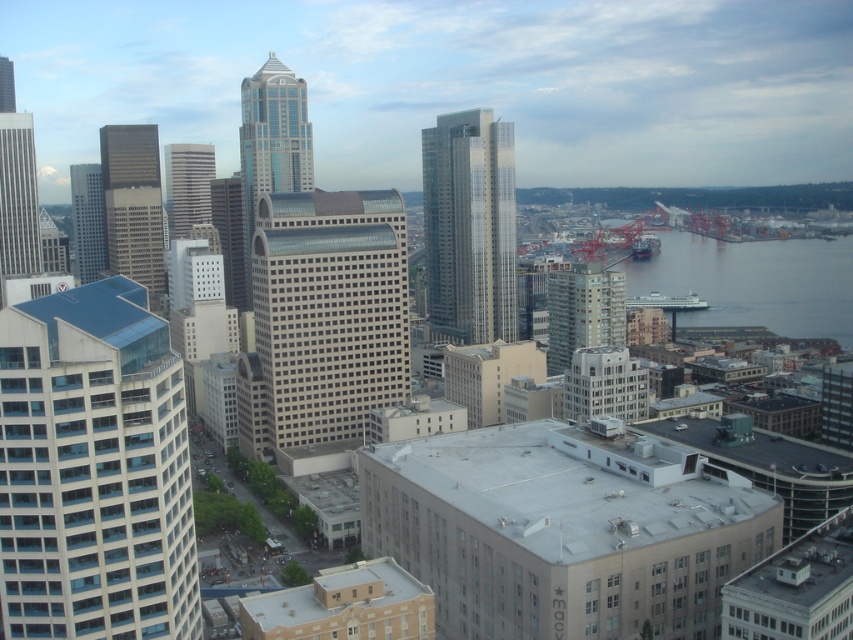
Who is more forward, (311, 170) or (73, 189)?

Point (311, 170)

In the scene shown: Is glassy steel skyscraper at center thinner than glassy reflective skyscraper at left?

Incorrect, glassy steel skyscraper at center's width is not less than glassy reflective skyscraper at left's.

Between point (287, 186) and point (94, 172), which one is positioned in front?

Positioned in front is point (287, 186).

Locate an element on the screen. The width and height of the screenshot is (853, 640). glassy steel skyscraper at center is located at coordinates (271, 144).

Does glassy steel skyscraper at center have a greater height compared to glassy concrete building at center?

Correct, glassy steel skyscraper at center is much taller as glassy concrete building at center.

Can you confirm if glassy steel skyscraper at center is positioned to the right of glassy concrete building at center?

Incorrect, glassy steel skyscraper at center is not on the right side of glassy concrete building at center.

At what (x,y) coordinates should I click in order to perform the action: click on glassy steel skyscraper at center. Please return your answer as a coordinate pair (x, y). Looking at the image, I should click on (271, 144).

The image size is (853, 640). Find the location of `glassy steel skyscraper at center`. glassy steel skyscraper at center is located at coordinates (271, 144).

Does gray concrete water at center right lie in front of matte glass skyscraper at center-left?

No, it is not.

What do you see at coordinates (753, 282) in the screenshot?
I see `gray concrete water at center right` at bounding box center [753, 282].

Where is `gray concrete water at center right`? gray concrete water at center right is located at coordinates (753, 282).